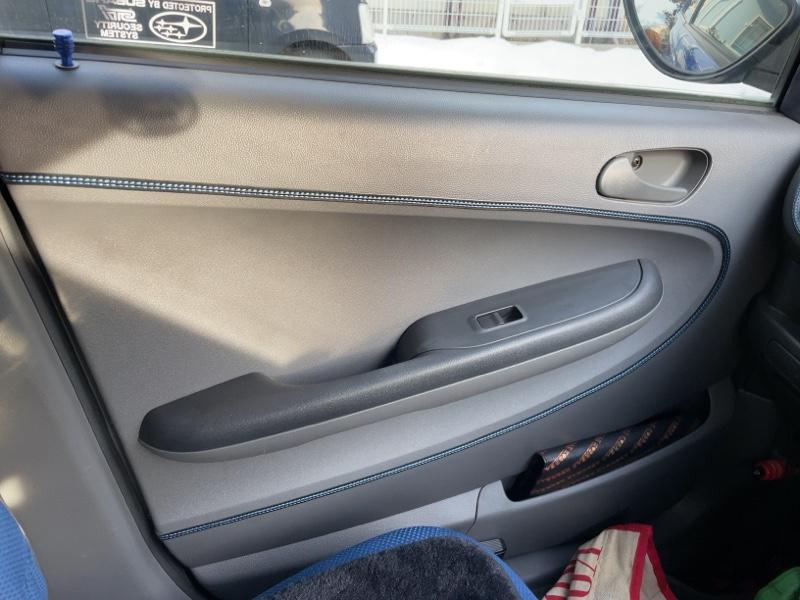
You are a GUI agent. You are given a task and a screenshot of the screen. Output one action in this format:
    pyautogui.click(x=<x>, y=<y>)
    Task: Click on the lock
    Image resolution: width=800 pixels, height=600 pixels.
    Given the screenshot: What is the action you would take?
    pyautogui.click(x=68, y=49)